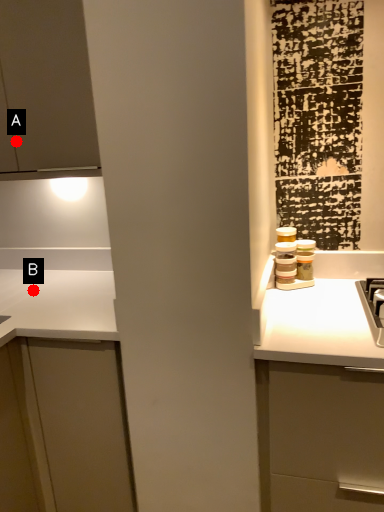
Question: Two points are circled on the image, labeled by A and B beside each circle. Which point is closer to the camera?

Choices:
 (A) A is closer
 (B) B is closer

Answer: (A)